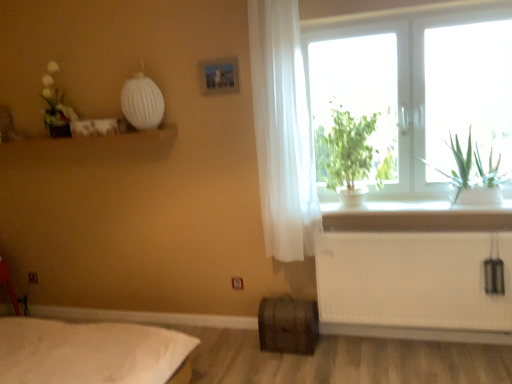
At what (x,y) coordinates should I click in order to perform the action: click on white textured radiator at lower right. Please return your answer as a coordinate pair (x, y). Image resolution: width=512 pixels, height=384 pixels. Looking at the image, I should click on (414, 274).

The image size is (512, 384). What do you see at coordinates (288, 325) in the screenshot? I see `rustic wooden barrel at lower center` at bounding box center [288, 325].

The width and height of the screenshot is (512, 384). Describe the element at coordinates (419, 92) in the screenshot. I see `white glass window at upper right` at that location.

Describe the element at coordinates (350, 155) in the screenshot. I see `green leafy plant at window` at that location.

I want to click on white textured radiator at lower right, so click(x=414, y=274).

From the image's perspective, which is above, white sheer curtain at right or green leafy plant at window?

white sheer curtain at right, from the image's perspective.

Which point is more forward, (x=288, y=85) or (x=451, y=143)?

The point (x=288, y=85) is closer.

Which object is wider, white sheer curtain at right or green leafy plant at window?

Wider between the two is green leafy plant at window.

Can green leafy plant at window be found inside white textured radiator at lower right?

That's incorrect, green leafy plant at window is not inside white textured radiator at lower right.

Is green leafy plant at window at the back of white textured radiator at lower right?

No, white textured radiator at lower right's orientation is not away from green leafy plant at window.

Is white textured radiator at lower right to the left of green leafy plant at window from the viewer's perspective?

Correct, you'll find white textured radiator at lower right to the left of green leafy plant at window.

Considering the relative sizes of metallic silver picture frame at upper center and white textured radiator at lower right in the image provided, is metallic silver picture frame at upper center thinner than white textured radiator at lower right?

Yes, metallic silver picture frame at upper center is thinner than white textured radiator at lower right.

Which object is positioned more to the right, metallic silver picture frame at upper center or white textured radiator at lower right?

Positioned to the right is white textured radiator at lower right.

From the image's perspective, would you say metallic silver picture frame at upper center is positioned over white textured radiator at lower right?

Yes.

Locate an element on the screen. The height and width of the screenshot is (384, 512). picture frame on the left of white textured radiator at lower right is located at coordinates [219, 76].

From a real-world perspective, which object stands above the other?

green leafy plant at window is physically above.

From the image's perspective, would you say green leafy plant at window is shown under green leafy plant at window?

Yes, from the image's perspective, green leafy plant at window is beneath green leafy plant at window.

Considering the relative sizes of green leafy plant at window and green leafy plant at window in the image provided, is green leafy plant at window wider than green leafy plant at window?

Yes, green leafy plant at window is wider than green leafy plant at window.

This screenshot has width=512, height=384. I want to click on curtain that appears in front of the green leafy plant at window, so click(283, 133).

Looking at this image, how many degrees apart are the facing directions of green leafy plant at window and white sheer curtain at right?

0.566 degrees.

From a real-world perspective, is green leafy plant at window located higher than white sheer curtain at right?

No, from a real-world perspective, green leafy plant at window is not on top of white sheer curtain at right.

Is green leafy plant at window completely or partially outside of white sheer curtain at right?

green leafy plant at window is positioned outside white sheer curtain at right.

Looking at this image, in terms of width, does rustic wooden barrel at lower center look wider or thinner when compared to white sheer curtain at right?

rustic wooden barrel at lower center is wider than white sheer curtain at right.

Find the location of a particular element. window box lying on the right of white sheer curtain at right is located at coordinates (288, 325).

Which of these two, rustic wooden barrel at lower center or white sheer curtain at right, is bigger?

With larger size is white sheer curtain at right.

Looking at this image, relative to white sheer curtain at right, is rustic wooden barrel at lower center in front or behind?

rustic wooden barrel at lower center is positioned farther from the viewer than white sheer curtain at right.

How many degrees apart are the facing directions of green leafy plant at window and rustic wooden barrel at lower center?

The facing directions of green leafy plant at window and rustic wooden barrel at lower center are 0.431 degrees apart.

Is rustic wooden barrel at lower center a part of green leafy plant at window?

No.

Which of these two, green leafy plant at window or rustic wooden barrel at lower center, stands taller?

With more height is green leafy plant at window.

Consider the image. From a real-world perspective, does green leafy plant at window sit lower than rustic wooden barrel at lower center?

Actually, green leafy plant at window is physically above rustic wooden barrel at lower center in the real world.

At what (x,y) coordinates should I click in order to perform the action: click on plant located in front of the white sheer curtain at right. Please return your answer as a coordinate pair (x, y). This screenshot has height=384, width=512. Looking at the image, I should click on (470, 175).

Locate an element on the screen. This screenshot has height=384, width=512. radiator that is below the green leafy plant at window (from the image's perspective) is located at coordinates (414, 274).

Looking at the image, which one is located further to rustic wooden barrel at lower center, white textured radiator at lower right or white sheer curtain at right?

Among the two, white sheer curtain at right is located further to rustic wooden barrel at lower center.

Which object lies nearer to the anchor point metallic silver picture frame at upper center, green leafy plant at window or white sheer curtain at right?

white sheer curtain at right is closer to metallic silver picture frame at upper center.

When comparing their distances from white textured radiator at lower right, does green leafy plant at window or white glass window at upper right seem further?

white glass window at upper right.

Looking at the image, which one is located closer to green leafy plant at window, white textured radiator at lower right or green leafy plant at window?

white textured radiator at lower right is closer to green leafy plant at window.

Estimate the real-world distances between objects in this image. Which object is closer to white glass window at upper right, green leafy plant at window or rustic wooden barrel at lower center?

Among the two, green leafy plant at window is located nearer to white glass window at upper right.

Estimate the real-world distances between objects in this image. Which object is closer to green leafy plant at window, green leafy plant at window or white sheer curtain at right?

green leafy plant at window is closer to green leafy plant at window.

Which object lies nearer to the anchor point green leafy plant at window, white sheer curtain at right or green leafy plant at window?

Based on the image, white sheer curtain at right appears to be nearer to green leafy plant at window.

Estimate the real-world distances between objects in this image. Which object is closer to metallic silver picture frame at upper center, rustic wooden barrel at lower center or white textured radiator at lower right?

white textured radiator at lower right is positioned closer to the anchor metallic silver picture frame at upper center.

Locate an element on the screen. radiator between green leafy plant at window and rustic wooden barrel at lower center in the up-down direction is located at coordinates (414, 274).

Image resolution: width=512 pixels, height=384 pixels. Find the location of `houseplant between metallic silver picture frame at upper center and white glass window at upper right from left to right`. houseplant between metallic silver picture frame at upper center and white glass window at upper right from left to right is located at coordinates (350, 155).

Where is `curtain between metallic silver picture frame at upper center and green leafy plant at window from left to right`? curtain between metallic silver picture frame at upper center and green leafy plant at window from left to right is located at coordinates (283, 133).

Find the location of a particular element. This screenshot has width=512, height=384. houseplant between metallic silver picture frame at upper center and white textured radiator at lower right from top to bottom is located at coordinates (350, 155).